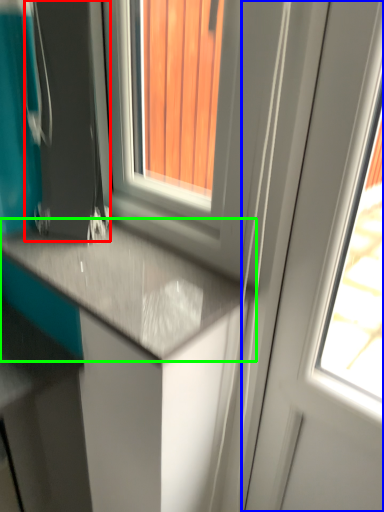
Question: Estimate the real-world distances between objects in this image. Which object is closer to appliance (highlighted by a red box), screen door (highlighted by a blue box) or countertop (highlighted by a green box)?

Choices:
 (A) screen door
 (B) countertop

Answer: (B)